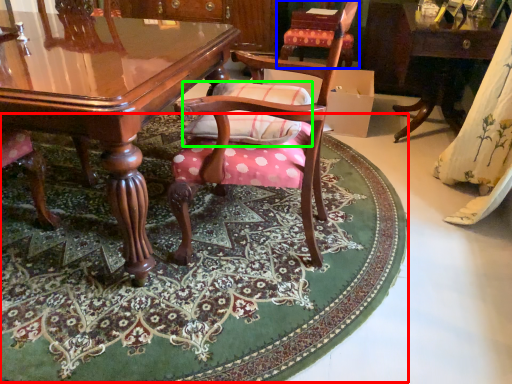
Question: Which is farther away from mat (highlighted by a red box)? chair (highlighted by a blue box) or pillow (highlighted by a green box)?

Choices:
 (A) chair
 (B) pillow

Answer: (A)